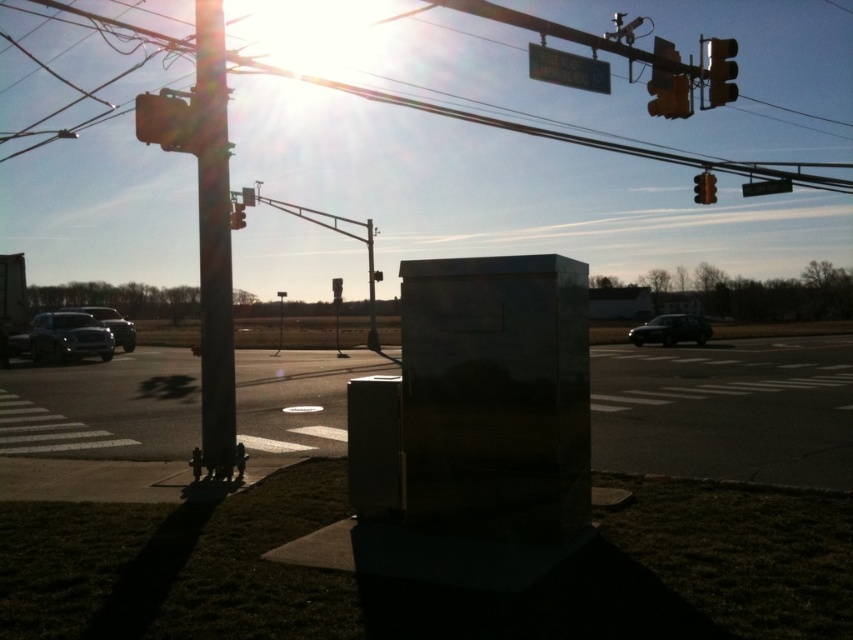
Based on the photo, does metallic pole at center appear on the right side of metallic at upper center?

Incorrect, metallic pole at center is not on the right side of metallic at upper center.

Which of these two, metallic pole at center or metallic at upper center, stands shorter?

Standing shorter between the two is metallic at upper center.

Is point (369, 230) behind point (241, 214)?

Yes, it is behind point (241, 214).

Identify the location of metallic pole at center. (370, 289).

Who is higher up, metallic pole at left or yellow matte traffic light at upper right?

yellow matte traffic light at upper right is higher up.

Is point (200, 202) less distant than point (662, 86)?

Yes, it is.

Where is `metallic pole at left`? Image resolution: width=853 pixels, height=640 pixels. metallic pole at left is located at coordinates (213, 243).

Image resolution: width=853 pixels, height=640 pixels. I want to click on metallic pole at left, so click(x=213, y=243).

Is shiny silver sedan at left closer to camera compared to metallic street sign at upper center?

No, it is behind metallic street sign at upper center.

What do you see at coordinates (111, 324) in the screenshot?
I see `shiny silver sedan at left` at bounding box center [111, 324].

Where is `shiny silver sedan at left`? shiny silver sedan at left is located at coordinates (111, 324).